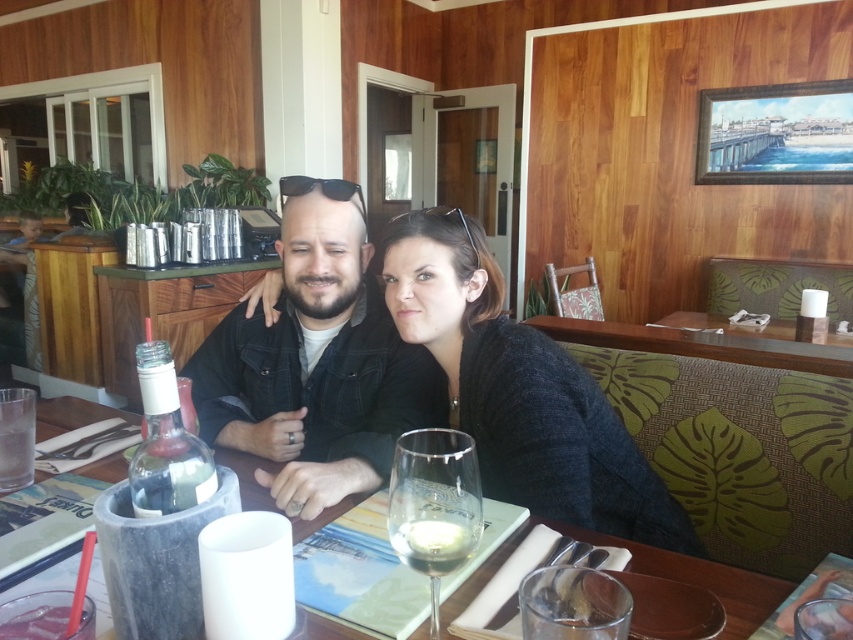
Question: Can you confirm if black denim jacket at center is positioned above dark gray sweater at center?

Choices:
 (A) yes
 (B) no

Answer: (A)

Question: Which point is farther to the camera?

Choices:
 (A) (473, 237)
 (B) (190, 477)

Answer: (A)

Question: In this image, where is black denim jacket at center located relative to translucent glass wine at center?

Choices:
 (A) above
 (B) below

Answer: (A)

Question: Is clear glass wine glass at center closer to the viewer compared to translucent glass bottle at center?

Choices:
 (A) yes
 (B) no

Answer: (A)

Question: Which point appears farthest from the camera in this image?

Choices:
 (A) (466, 540)
 (B) (169, 364)
 (C) (468, 288)
 (D) (787, 589)

Answer: (C)

Question: Which of the following is the closest to the observer?

Choices:
 (A) black denim jacket at center
 (B) dark gray sweater at center

Answer: (A)